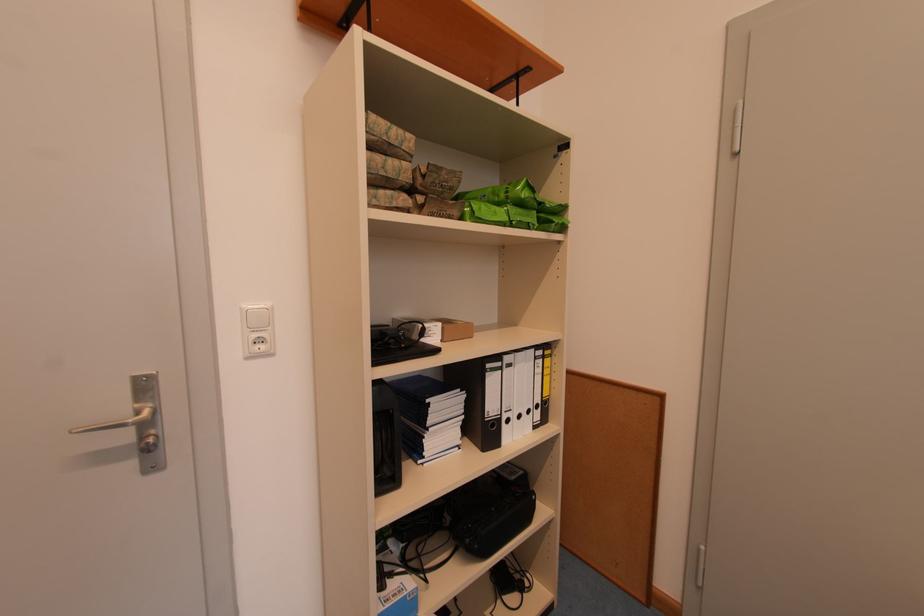
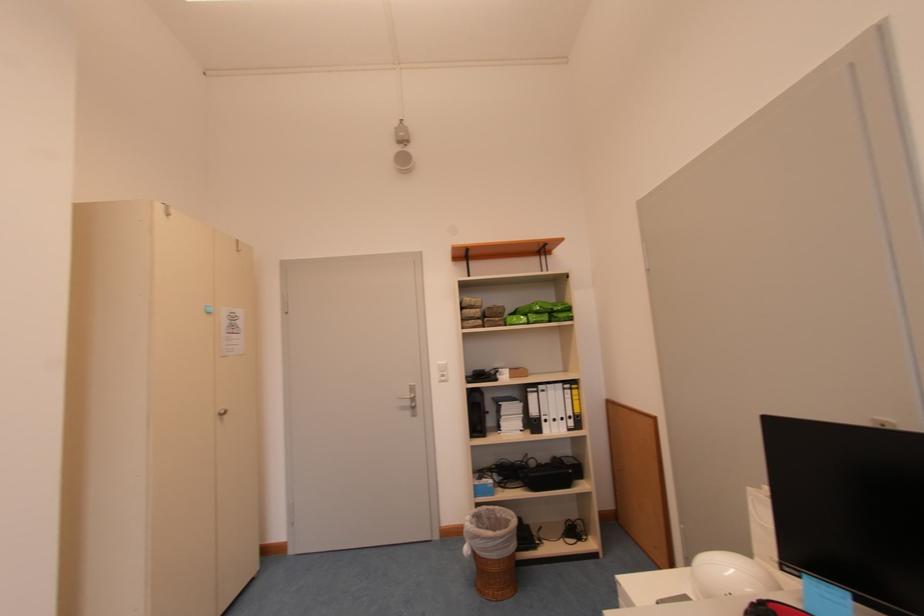
Where in the second image is the point corresponding to point 131,440 from the first image?

(415, 406)